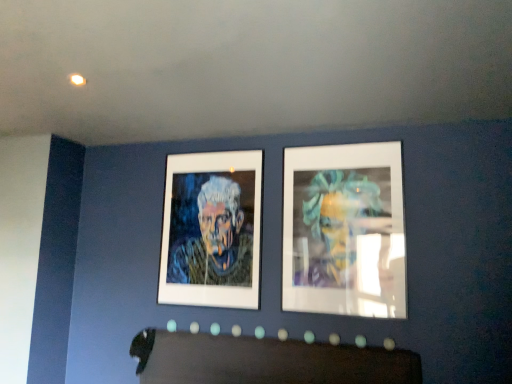
Question: Looking at the image, does white matte picture frame at upper right seem bigger or smaller compared to oil painting portrait at center?

Choices:
 (A) big
 (B) small

Answer: (A)

Question: Does point (385, 297) appear closer or farther from the camera than point (236, 249)?

Choices:
 (A) farther
 (B) closer

Answer: (B)

Question: Relative to oil painting portrait at center, is white matte picture frame at upper right in front or behind?

Choices:
 (A) front
 (B) behind

Answer: (A)

Question: Considering the positions of oil painting portrait at center and white matte picture frame at upper right in the image, is oil painting portrait at center bigger or smaller than white matte picture frame at upper right?

Choices:
 (A) small
 (B) big

Answer: (A)

Question: Considering the relative positions of oil painting portrait at center and white matte picture frame at upper right in the image provided, is oil painting portrait at center to the left or to the right of white matte picture frame at upper right?

Choices:
 (A) right
 (B) left

Answer: (B)

Question: Do you think oil painting portrait at center is within white matte picture frame at upper right, or outside of it?

Choices:
 (A) outside
 (B) inside

Answer: (A)

Question: Considering their positions, is oil painting portrait at center located in front of or behind white matte picture frame at upper right?

Choices:
 (A) behind
 (B) front

Answer: (A)